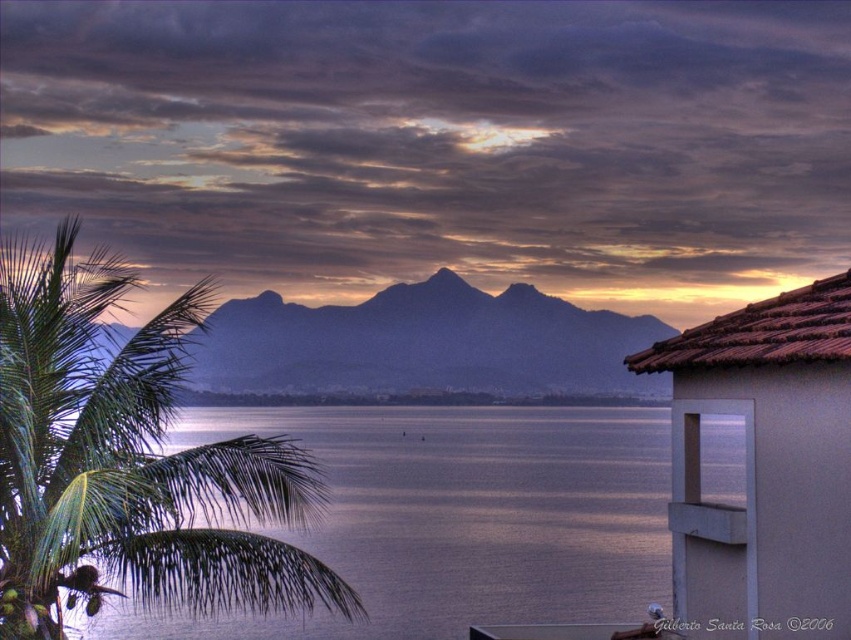
Question: Can you confirm if green leafy palm tree at left is bigger than smokey gray mountain at center?

Choices:
 (A) no
 (B) yes

Answer: (A)

Question: Does smokey gray water at center appear on the right side of metallic gray balcony at lower right?

Choices:
 (A) yes
 (B) no

Answer: (B)

Question: Which point is farther to the camera?

Choices:
 (A) (431, 388)
 (B) (724, 589)
 (C) (543, 408)
 (D) (10, 332)

Answer: (A)

Question: Among these points, which one is farthest from the camera?

Choices:
 (A) (701, 509)
 (B) (230, 570)

Answer: (A)

Question: Which point is closer to the camera taking this photo?

Choices:
 (A) (230, 339)
 (B) (569, 515)
 (C) (4, 422)

Answer: (C)

Question: Is smokey gray water at center thinner than metallic gray balcony at lower right?

Choices:
 (A) no
 (B) yes

Answer: (A)